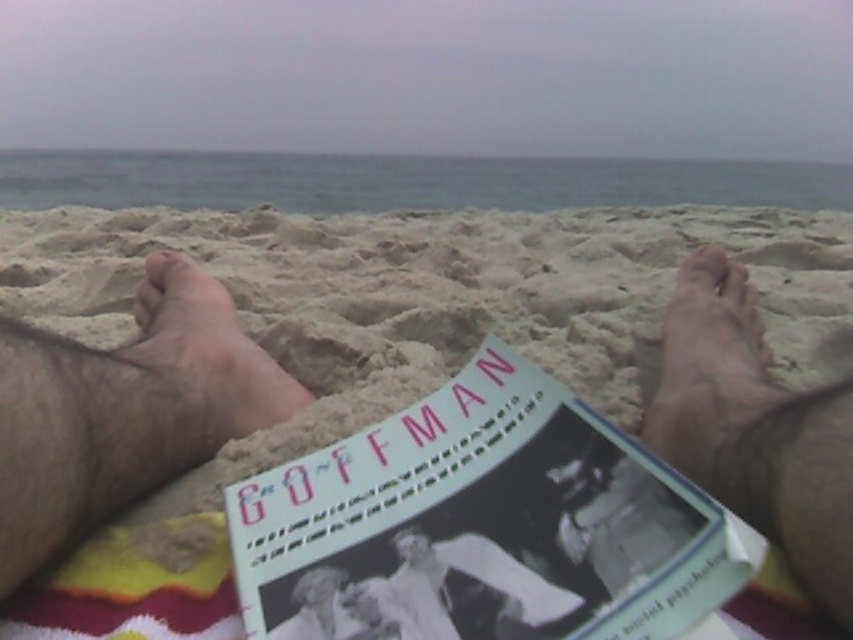
Who is more forward, (761, 348) or (209, 305)?

Point (761, 348) is more forward.

Which is more to the left, smooth skin feet at lower right or brown hairy foot at left?

From the viewer's perspective, brown hairy foot at left appears more on the left side.

Where is `smooth skin feet at lower right`? This screenshot has width=853, height=640. smooth skin feet at lower right is located at coordinates (755, 428).

Identify the location of smooth skin feet at lower right. (755, 428).

Can you confirm if beige sand at center is shorter than brown hairy foot at left?

Incorrect, beige sand at center's height does not fall short of brown hairy foot at left's.

Between beige sand at center and brown hairy foot at left, which one has less height?

brown hairy foot at left

Is point (99, 252) positioned in front of point (242, 385)?

No, (99, 252) is behind (242, 385).

You are a GUI agent. You are given a task and a screenshot of the screen. Output one action in this format:
    pyautogui.click(x=<x>, y=<y>)
    Task: Click on the beige sand at center
    The height and width of the screenshot is (640, 853).
    Given the screenshot: What is the action you would take?
    pyautogui.click(x=384, y=346)

What do you see at coordinates (708, 364) in the screenshot? I see `dry sand at right` at bounding box center [708, 364].

Is point (677, 458) closer to viewer compared to point (212, 390)?

Yes, it is in front of point (212, 390).

You are a GUI agent. You are given a task and a screenshot of the screen. Output one action in this format:
    pyautogui.click(x=<x>, y=<y>)
    Task: Click on the dry sand at right
    The height and width of the screenshot is (640, 853).
    Given the screenshot: What is the action you would take?
    pyautogui.click(x=708, y=364)